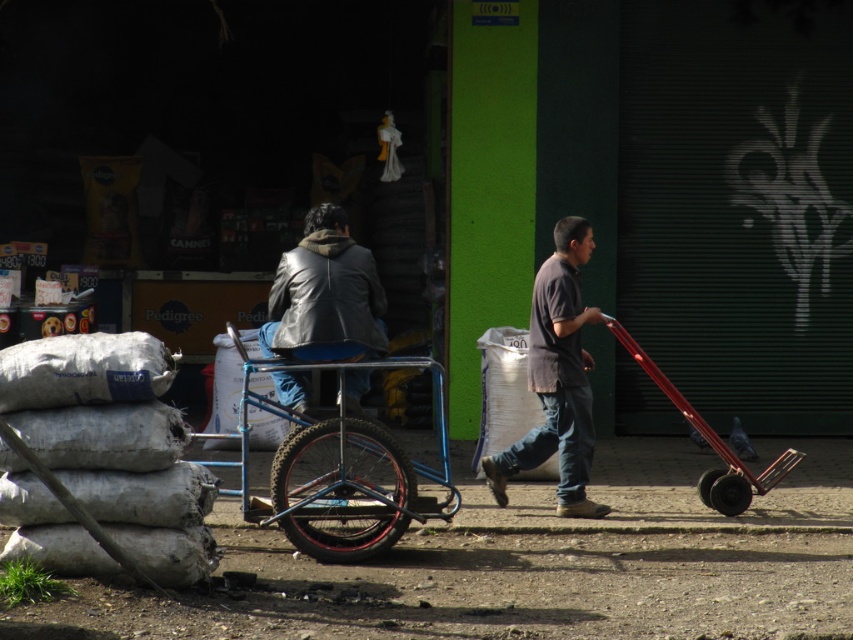
You are a delivery person who needs to place a package between the blue metallic wagon at center and the dark gray shirt at center. The package requires 3 feet of space. Is there enough space between them?

The blue metallic wagon at center and dark gray shirt at center are 3.70 feet apart from each other, which is more than the required 3 feet. Therefore, there is enough space to place the package between them.

You are standing at the point labeled point (373,323) and want to walk to the point labeled point (300,445). Which direction should you face to move towards your destination?

You should face forward because point (300,445) is in front of point (373,323).

You are a pedestrian standing at the center of the urban street scene. You notice two people wearing dark gray shirt at center and leather jacket at center. Which one is closer to you?

The dark gray shirt at center is closer to you because the leather jacket at center is behind it.